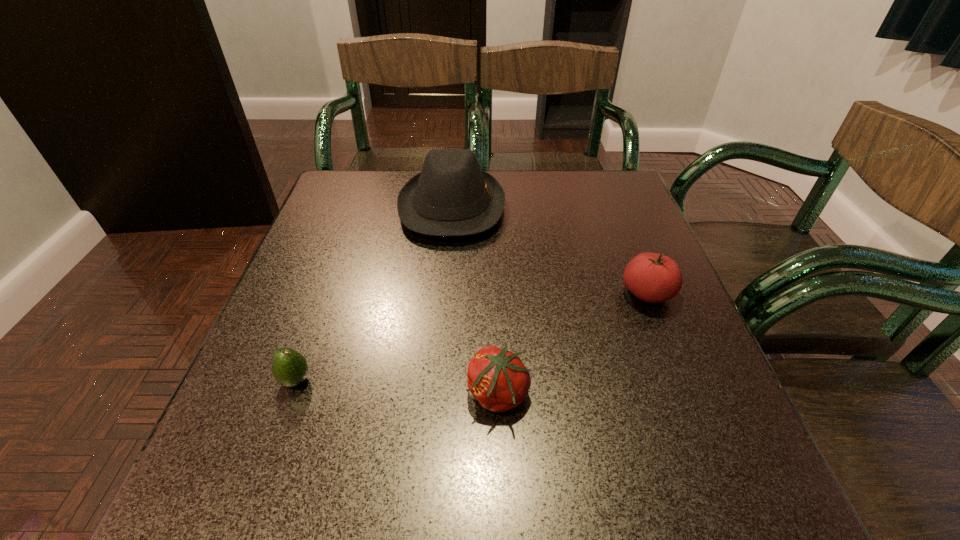
I want to click on free space at the near right corner of the desktop, so click(x=732, y=503).

Identify the location of free space that is in between the avocado and the second tallest object. This screenshot has height=540, width=960. (471, 336).

What are the coordinates of `free space between the avocado and the farthest object` in the screenshot? It's located at (373, 293).

At what (x,y) coordinates should I click in order to perform the action: click on vacant point located between the avocado and the farthest object. Please return your answer as a coordinate pair (x, y). This screenshot has width=960, height=540. Looking at the image, I should click on (373, 293).

This screenshot has height=540, width=960. In order to click on vacant point located between the left tomato and the fedora in this screenshot , I will do `click(475, 300)`.

Identify the location of free spot between the fedora and the avocado. The width and height of the screenshot is (960, 540). (373, 293).

The image size is (960, 540). I want to click on unoccupied position between the shorter tomato and the tallest object, so click(475, 300).

Where is `vacant region between the tallest object and the leftmost object`? This screenshot has height=540, width=960. vacant region between the tallest object and the leftmost object is located at coordinates (373, 293).

At what (x,y) coordinates should I click in order to perform the action: click on vacant area that lies between the farthest object and the right tomato. Please return your answer as a coordinate pair (x, y). Image resolution: width=960 pixels, height=540 pixels. Looking at the image, I should click on (549, 250).

Where is `free space between the fedora and the leftmost object`? free space between the fedora and the leftmost object is located at coordinates (373, 293).